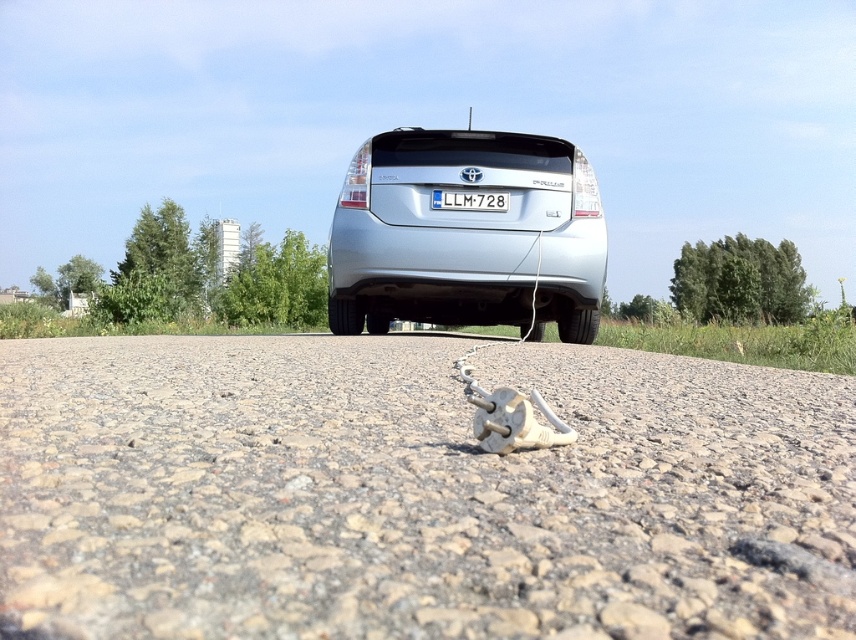
You are a delivery driver who needs to park your car in a tight space. The silver metallic car at center is parked in front of you. Can you estimate whether the white plastic license plate at center is smaller than the car?

The silver metallic car at center has a larger size compared to white plastic license plate at center, so yes, the white plastic license plate at center is smaller than the car.

You are a delivery robot with a maximum reach of 2 meters. You need to pick up the white plastic license plate at center from the gray gravel at center. Can your arm reach it?

The distance between gray gravel at center and white plastic license plate at center is 2.16 meters, which exceeds the robot arm reach of 2 meters. The robot cannot reach it.

Based on the photo, you are a delivery driver who needs to park your car in a narrow alley that can only accommodate vehicles up to the width of the white plastic license plate at center. Can your silver metallic car at center fit into this alley based on the given information?

The silver metallic car at center is wider than the white plastic license plate at center, so it cannot fit into the alley which can only accommodate vehicles up to the license plate width.